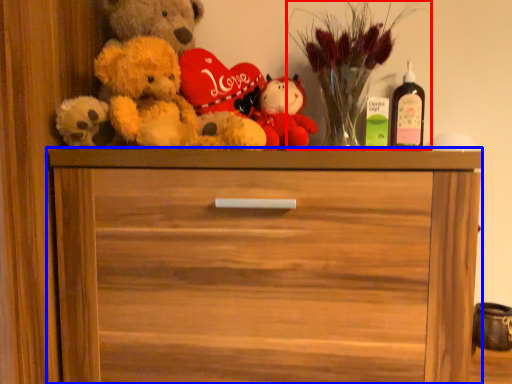
Question: Which object appears closest to the camera in this image, floral arrangement (highlighted by a red box) or chest of drawers (highlighted by a blue box)?

Choices:
 (A) floral arrangement
 (B) chest of drawers

Answer: (B)